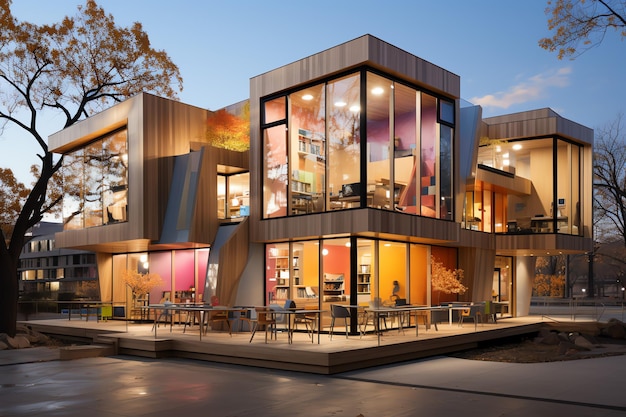
The image size is (626, 417). I want to click on table, so pyautogui.click(x=307, y=312), pyautogui.click(x=225, y=312), pyautogui.click(x=386, y=314), pyautogui.click(x=424, y=312).